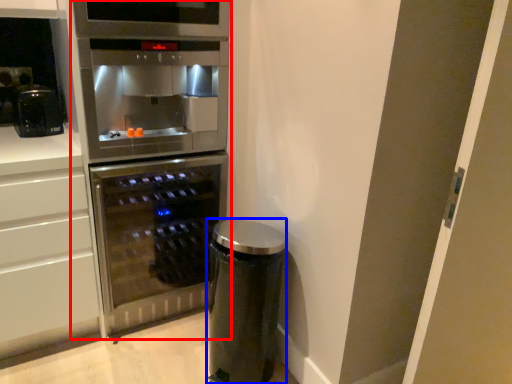
Question: Among these objects, which one is farthest to the camera, fridge (highlighted by a red box) or appliance (highlighted by a blue box)?

Choices:
 (A) fridge
 (B) appliance

Answer: (B)